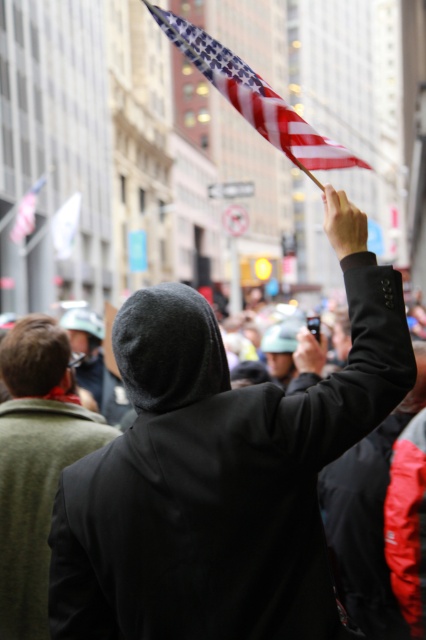
You are a photographer trying to capture the American flag held by the person in the foreground. You notice a point at coordinates (36, 464). What object is located at this point?

The point at coordinates (36, 464) corresponds to the dark gray hoodie at center.

You are a photographer trying to capture the scene of the protest. You want to place your camera exactly at the center of the image to capture the most important elements. Given the black matte coat at upper center, where should you position your camera to ensure it is centered in your shot?

To center the black matte coat at upper center in your shot, position your camera at the coordinates provided by its 2D location, which is at point (x=216, y=477). This will ensure the coat is centered in the frame.

You are a photographer trying to capture the American flag held by the person in the foreground. The camera you are using has a fixed focus point at point (216, 477). Will the American flag be in focus in your photo?

The black matte coat at upper center is located at point (216, 477), so the American flag will not be in focus because the focus point is on the black matte coat at upper center instead of the flag.